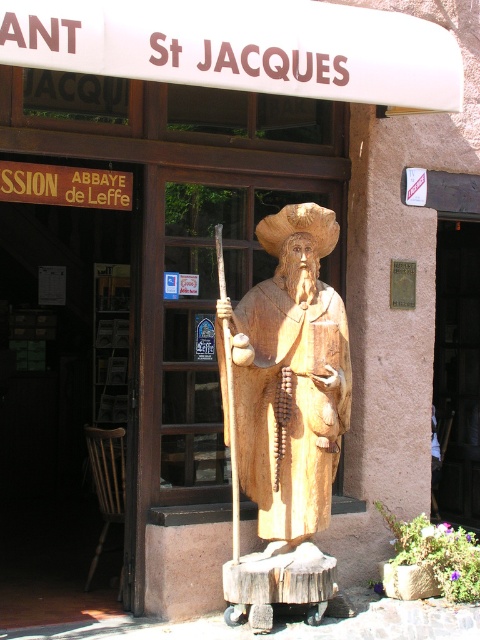
Question: Considering the relative positions of wooden statue at center and smooth stone door at center in the image provided, where is wooden statue at center located with respect to smooth stone door at center?

Choices:
 (A) above
 (B) below

Answer: (A)

Question: Observing the image, what is the correct spatial positioning of wooden statue at center in reference to smooth stone door at center?

Choices:
 (A) right
 (B) left

Answer: (B)

Question: Which of the following is the farthest from the observer?

Choices:
 (A) (312, 273)
 (B) (465, 280)

Answer: (B)

Question: Where is wooden statue at center located in relation to smooth stone door at center in the image?

Choices:
 (A) below
 (B) above

Answer: (B)